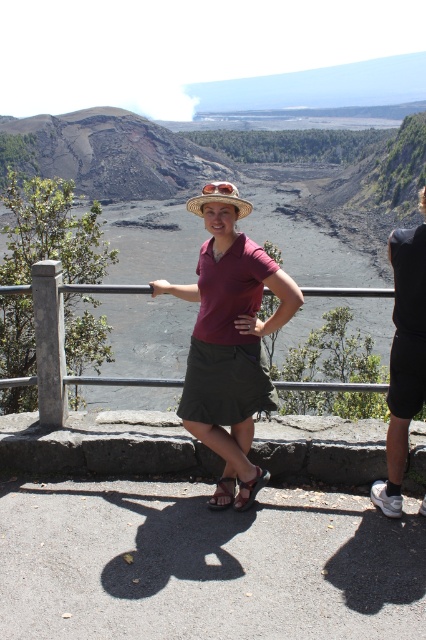
Question: Which of the following is the farthest from the observer?

Choices:
 (A) dark gray shorts at right
 (B) straw hat at center
 (C) brown leather sandal at lower center

Answer: (C)

Question: Does matte maroon shirt at center have a greater width compared to brown leather sandal at center?

Choices:
 (A) yes
 (B) no

Answer: (A)

Question: Which object is positioned farthest from the brown leather sandal at lower center?

Choices:
 (A) brown leather sandal at center
 (B) dark gray shorts at right

Answer: (B)

Question: Is dark gray shorts at right below brown leather sandal at lower center?

Choices:
 (A) yes
 (B) no

Answer: (B)

Question: Which object is positioned farthest from the dark gray shorts at right?

Choices:
 (A) brown leather sandal at center
 (B) matte maroon shirt at center
 (C) straw hat at center

Answer: (C)

Question: Is the position of matte maroon shirt at center more distant than that of brown leather sandal at lower center?

Choices:
 (A) no
 (B) yes

Answer: (A)